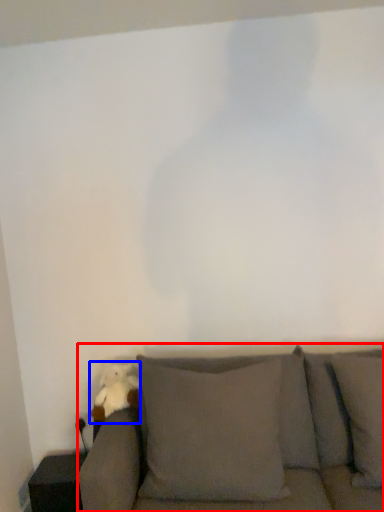
Question: Which point is closer to the camera, studio couch (highlighted by a red box) or toy (highlighted by a blue box)?

Choices:
 (A) studio couch
 (B) toy

Answer: (A)